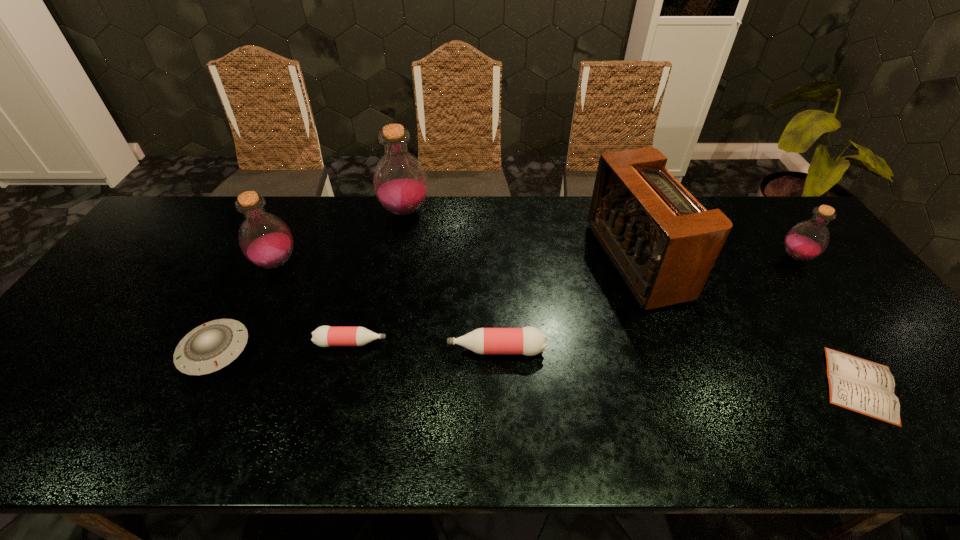
Where is `vacant space at the far edge`? The height and width of the screenshot is (540, 960). vacant space at the far edge is located at coordinates (234, 203).

Where is `free space at the near edge`? The width and height of the screenshot is (960, 540). free space at the near edge is located at coordinates (297, 452).

Find the location of a particular element. vacant area at the left edge is located at coordinates (56, 413).

In the image, there is a desktop. Where is `blank space at the right edge`? blank space at the right edge is located at coordinates (860, 350).

I want to click on vacant area at the far left corner, so click(177, 201).

What are the coordinates of `empty space that is in between the radio receiver and the right pink bottle` in the screenshot? It's located at pos(566,306).

The width and height of the screenshot is (960, 540). In order to click on empty location between the saucer and the fifth tallest object in this screenshot , I will do `click(355, 350)`.

Identify the location of vacant space that is in between the third object from right to left and the white diary. The image size is (960, 540). (749, 323).

Identify the location of vacant region between the fourth object from right to left and the second purple bottle from right to left. This screenshot has height=540, width=960. [450, 281].

You are a GUI agent. You are given a task and a screenshot of the screen. Output one action in this format:
    pyautogui.click(x=<x>, y=<y>)
    Task: Click on the empty location between the shortest object and the rightmost bottle
    This screenshot has width=960, height=540.
    Given the screenshot: What is the action you would take?
    pyautogui.click(x=828, y=321)